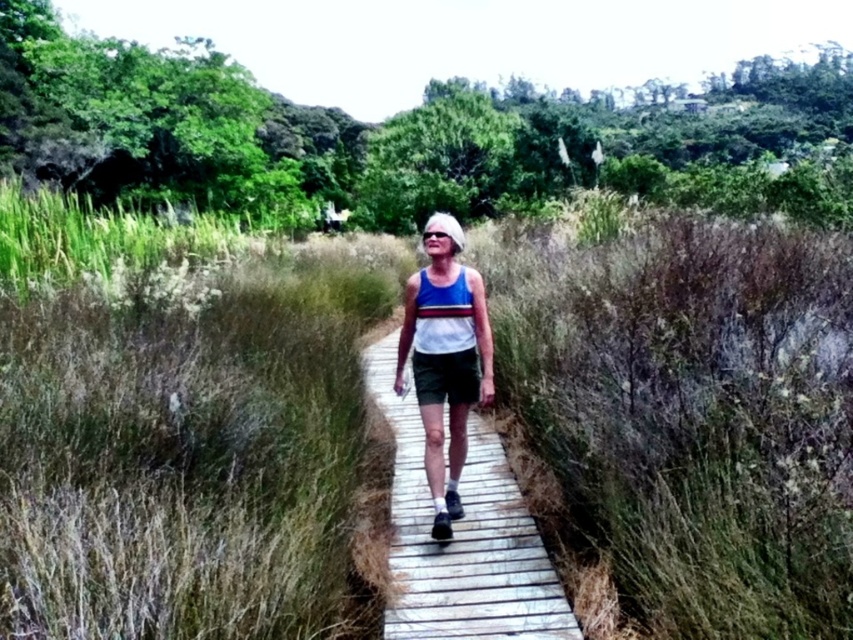
You are standing at the starting point of the boardwalk and want to reach the end. There are two markers along the path labeled as point (107, 467) and point (97, 216). Which marker is closer to your current position?

Point (107, 467) is closer to the camera than point (97, 216), so the marker at point (107, 467) is closer to your current position.

You are a drone operator trying to capture a photo of the person walking on the boardwalk. The camera is currently focused on the green grass at center located at point (178, 424). To adjust the focus to the person, should you move the camera focus point upwards or downwards?

The green grass at center is located at point (178, 424). Since the person is walking along the boardwalk which is at a lower position than the grass at center, you should move the camera focus point downwards to focus on the person.

You are standing at the starting point of the wooden boardwalk at center and want to walk to the end. If your average walking speed is 1.5 meters per second, how many seconds will it take you to reach the end?

The distance between the wooden boardwalk at center and the camera is 1.98 meters. Since you are starting at the boardwalk, the time to reach the end would be distance divided by speed, so 1.98 meters divided by 1.5 meters per second equals approximately 1.32 seconds.